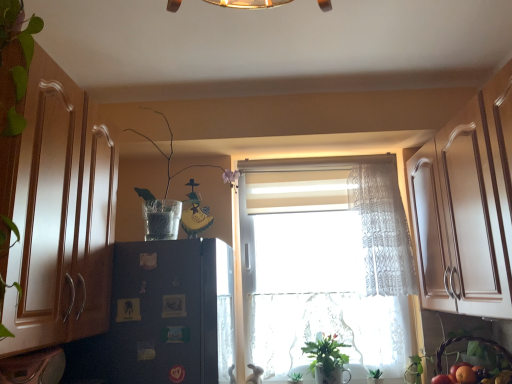
Question: Should I look upward or downward to see green leafy plant at lower center, placed as the 2th plant when sorted from front to back?

Choices:
 (A) up
 (B) down

Answer: (B)

Question: From the image's perspective, is wooden cabinet at left located beneath green matte plant at lower center?

Choices:
 (A) no
 (B) yes

Answer: (A)

Question: Is wooden cabinet at left aimed at green matte plant at lower center?

Choices:
 (A) no
 (B) yes

Answer: (A)

Question: Does wooden cabinet at left appear on the left side of green matte plant at lower center?

Choices:
 (A) yes
 (B) no

Answer: (A)

Question: Does wooden cabinet at left have a greater width compared to green matte plant at lower center?

Choices:
 (A) yes
 (B) no

Answer: (A)

Question: Are wooden cabinet at left and green matte plant at lower center beside each other?

Choices:
 (A) no
 (B) yes

Answer: (A)

Question: From a real-world perspective, is wooden cabinet at left located beneath green matte plant at lower center?

Choices:
 (A) yes
 (B) no

Answer: (B)

Question: Would you say black matte refrigerator at left is outside clear glass vase at upper center, the second plant from the back?

Choices:
 (A) no
 (B) yes

Answer: (B)

Question: Is the position of black matte refrigerator at left less distant than that of clear glass vase at upper center, the first plant when ordered from top to bottom?

Choices:
 (A) yes
 (B) no

Answer: (A)

Question: Considering the relative sizes of black matte refrigerator at left and clear glass vase at upper center, the second plant from the back, in the image provided, is black matte refrigerator at left smaller than clear glass vase at upper center, the second plant from the back,?

Choices:
 (A) yes
 (B) no

Answer: (B)

Question: Does black matte refrigerator at left have a lesser height compared to clear glass vase at upper center, the second plant from the back?

Choices:
 (A) yes
 (B) no

Answer: (B)

Question: Is black matte refrigerator at left wider than clear glass vase at upper center, the 2th plant from the bottom?

Choices:
 (A) no
 (B) yes

Answer: (B)

Question: Is black matte refrigerator at left thinner than clear glass vase at upper center, the first plant when ordered from top to bottom?

Choices:
 (A) yes
 (B) no

Answer: (B)

Question: Is orange matte at lower right bigger than clear glass vase at upper center, the first plant when ordered from front to back?

Choices:
 (A) yes
 (B) no

Answer: (B)